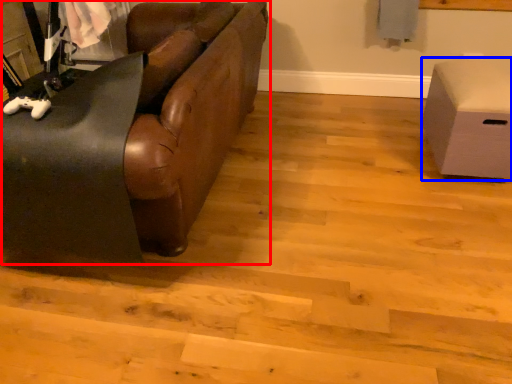
Question: Which object is further to the camera taking this photo, studio couch (highlighted by a red box) or furniture (highlighted by a blue box)?

Choices:
 (A) studio couch
 (B) furniture

Answer: (B)